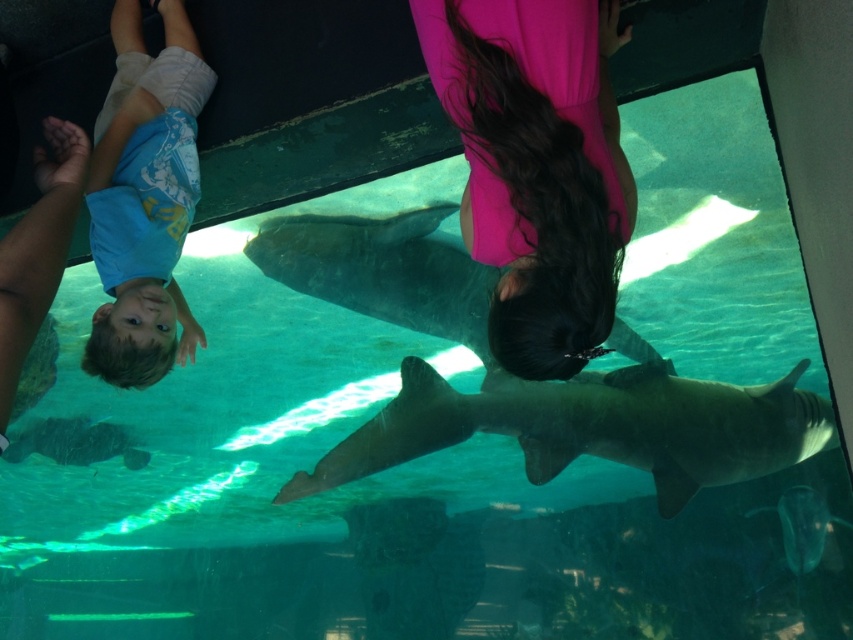
Question: Does smooth gray shark at center appear on the left side of blue cotton shirt at upper left?

Choices:
 (A) no
 (B) yes

Answer: (A)

Question: Which point is farther to the camera?

Choices:
 (A) click(x=440, y=45)
 (B) click(x=584, y=422)
 (C) click(x=114, y=163)

Answer: (B)

Question: Among these points, which one is nearest to the camera?

Choices:
 (A) (560, 109)
 (B) (405, 392)

Answer: (A)

Question: Among these objects, which one is nearest to the camera?

Choices:
 (A) smooth gray shark at center
 (B) pink fabric at center
 (C) blue cotton shirt at upper left

Answer: (B)

Question: Is smooth gray shark at center positioned at the back of blue cotton shirt at upper left?

Choices:
 (A) yes
 (B) no

Answer: (A)

Question: Can you confirm if pink fabric at center is positioned above smooth gray shark at center?

Choices:
 (A) no
 (B) yes

Answer: (B)